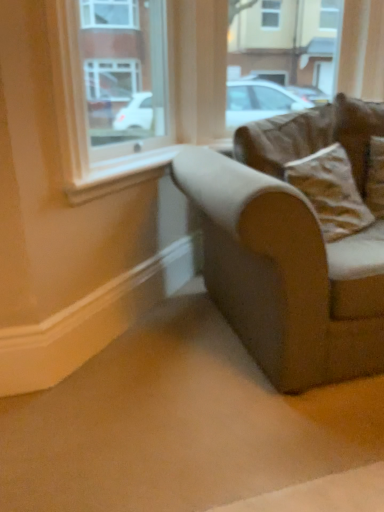
Question: Considering the relative sizes of brown suede pillow at upper right, marked as the second pillow in a bottom-to-top arrangement, and clear glass window at upper left in the image provided, is brown suede pillow at upper right, marked as the second pillow in a bottom-to-top arrangement, shorter than clear glass window at upper left?

Choices:
 (A) yes
 (B) no

Answer: (A)

Question: From a real-world perspective, is brown suede pillow at upper right, which is counted as the 1th pillow, starting from the top, positioned under clear glass window at upper left based on gravity?

Choices:
 (A) yes
 (B) no

Answer: (A)

Question: Is brown suede pillow at upper right, which is counted as the 1th pillow, starting from the top, far away from clear glass window at upper left?

Choices:
 (A) no
 (B) yes

Answer: (B)

Question: Is brown suede pillow at upper right, which is counted as the 1th pillow, starting from the top, aimed at clear glass window at upper left?

Choices:
 (A) yes
 (B) no

Answer: (B)

Question: Is brown suede pillow at upper right, which is counted as the 1th pillow, starting from the top, taller than clear glass window at upper left?

Choices:
 (A) yes
 (B) no

Answer: (B)

Question: From their relative heights in the image, would you say clear glass window at upper left is taller or shorter than brown fabric couch at right?

Choices:
 (A) tall
 (B) short

Answer: (B)

Question: Is clear glass window at upper left inside or outside of brown fabric couch at right?

Choices:
 (A) outside
 (B) inside

Answer: (A)

Question: In terms of size, does clear glass window at upper left appear bigger or smaller than brown fabric couch at right?

Choices:
 (A) big
 (B) small

Answer: (B)

Question: Does point (69, 22) appear closer or farther from the camera than point (321, 113)?

Choices:
 (A) farther
 (B) closer

Answer: (B)

Question: Is brown fabric couch at right inside or outside of brown suede pillow at upper right, marked as the second pillow in a bottom-to-top arrangement?

Choices:
 (A) outside
 (B) inside

Answer: (A)

Question: In terms of size, does brown fabric couch at right appear bigger or smaller than brown suede pillow at upper right, marked as the second pillow in a bottom-to-top arrangement?

Choices:
 (A) small
 (B) big

Answer: (B)

Question: Is brown fabric couch at right in front of or behind brown suede pillow at upper right, which is counted as the 1th pillow, starting from the top, in the image?

Choices:
 (A) behind
 (B) front

Answer: (B)

Question: From their relative heights in the image, would you say brown fabric couch at right is taller or shorter than brown suede pillow at upper right, which is counted as the 1th pillow, starting from the top?

Choices:
 (A) short
 (B) tall

Answer: (B)

Question: Considering the positions of brown fabric couch at right and brown fabric pillow at right, which is the 1th pillow in bottom-to-top order, in the image, is brown fabric couch at right bigger or smaller than brown fabric pillow at right, which is the 1th pillow in bottom-to-top order,?

Choices:
 (A) small
 (B) big

Answer: (B)

Question: Do you think brown fabric couch at right is within brown fabric pillow at right, which is the 1th pillow in bottom-to-top order, or outside of it?

Choices:
 (A) outside
 (B) inside

Answer: (A)